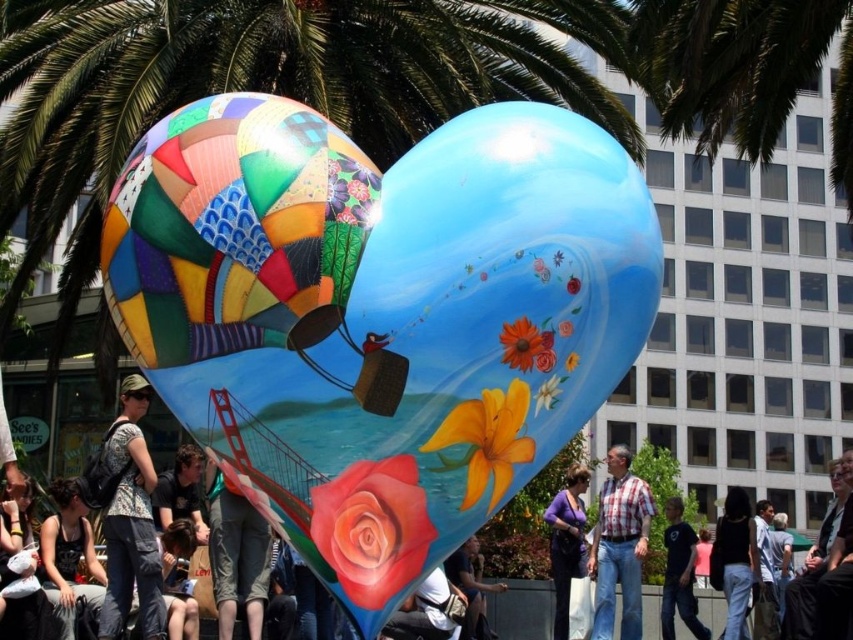
Question: Estimate the real-world distances between objects in this image. Which object is closer to the green leafy palm tree at upper right?

Choices:
 (A) dark blue t-shirt at center
 (B) green leafy palm tree at upper left
 (C) multicolored fabric heart at center
 (D) denim jacket at lower left

Answer: (B)

Question: Which point is closer to the camera?

Choices:
 (A) purple fabric at center
 (B) matte black tank top at lower left
 (C) denim jacket at lower left
 (D) denim jacket at lower center

Answer: (D)

Question: Can you confirm if denim pants at center is positioned below dark blue t-shirt at center?

Choices:
 (A) yes
 (B) no

Answer: (B)

Question: Can you confirm if green leafy palm tree at upper right is wider than plaid shirt at center?

Choices:
 (A) yes
 (B) no

Answer: (A)

Question: Is green leafy palm tree at upper left to the left of matte black tank top at lower left from the viewer's perspective?

Choices:
 (A) no
 (B) yes

Answer: (A)

Question: Which is farther from the plaid shirt at center?

Choices:
 (A) dark blue t-shirt at center
 (B) denim pants at center

Answer: (B)